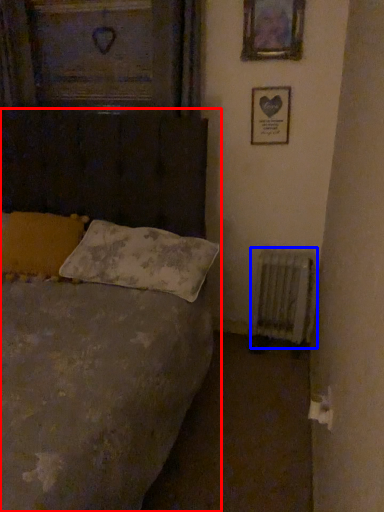
Question: Which object appears farthest to the camera in this image, bed (highlighted by a red box) or radiator (highlighted by a blue box)?

Choices:
 (A) bed
 (B) radiator

Answer: (B)